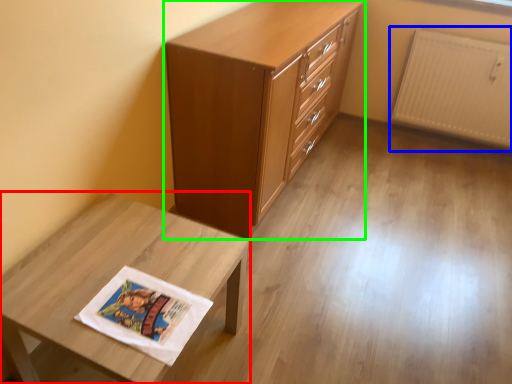
Question: Based on their relative distances, which object is farther from table (highlighted by a red box)? Choose from radiator (highlighted by a blue box) and chest of drawers (highlighted by a green box).

Choices:
 (A) radiator
 (B) chest of drawers

Answer: (A)